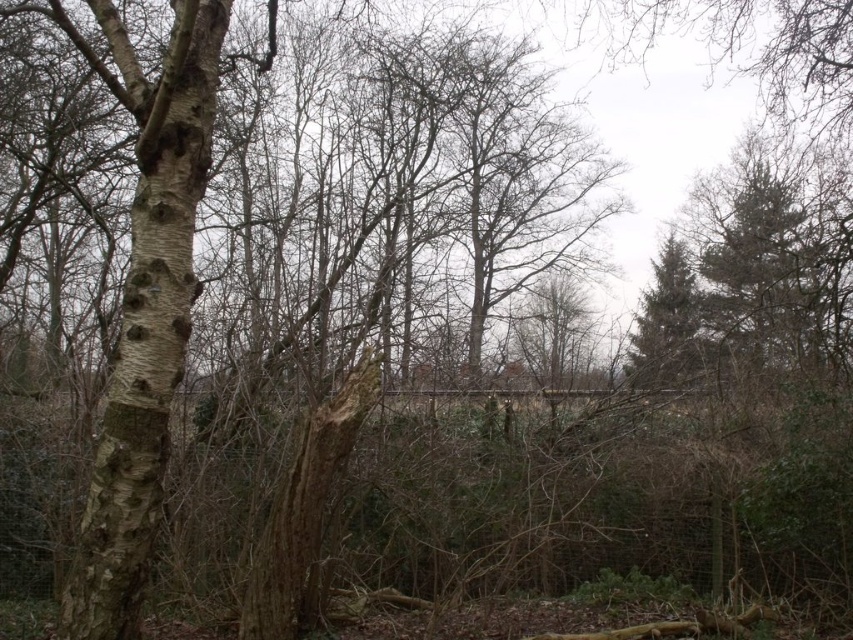
Who is positioned more to the left, barky white birch tree at left or green textured pine tree at right?

From the viewer's perspective, barky white birch tree at left appears more on the left side.

Describe the element at coordinates (144, 308) in the screenshot. The height and width of the screenshot is (640, 853). I see `barky white birch tree at left` at that location.

The image size is (853, 640). What do you see at coordinates (144, 308) in the screenshot? I see `barky white birch tree at left` at bounding box center [144, 308].

Locate an element on the screen. barky white birch tree at left is located at coordinates (144, 308).